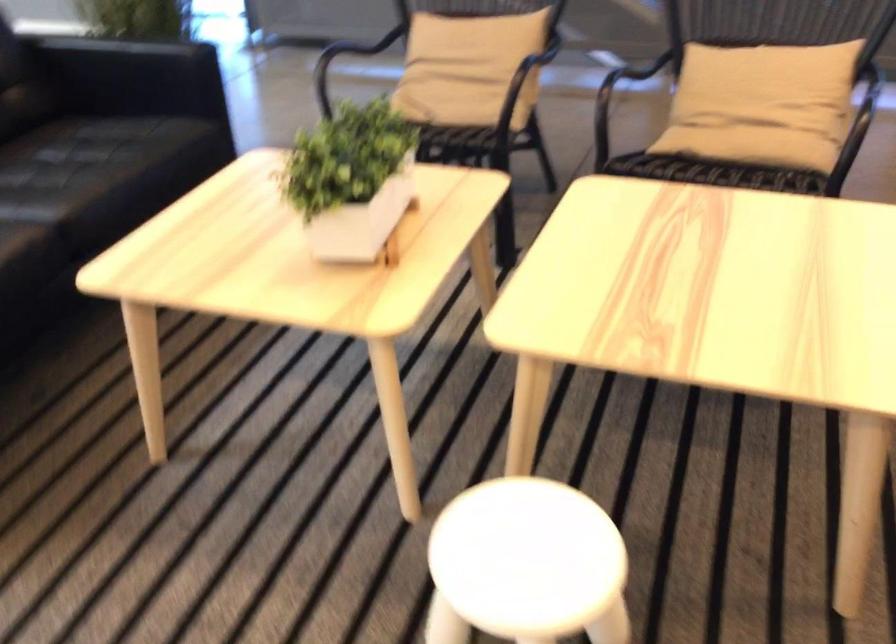
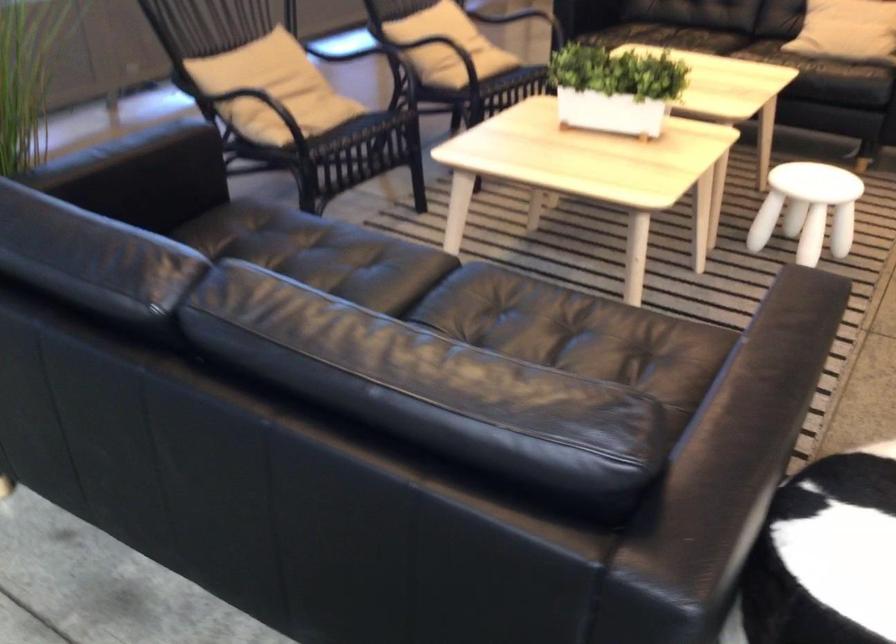
Where in the second image is the point corresponding to [357,180] from the first image?

(615, 88)